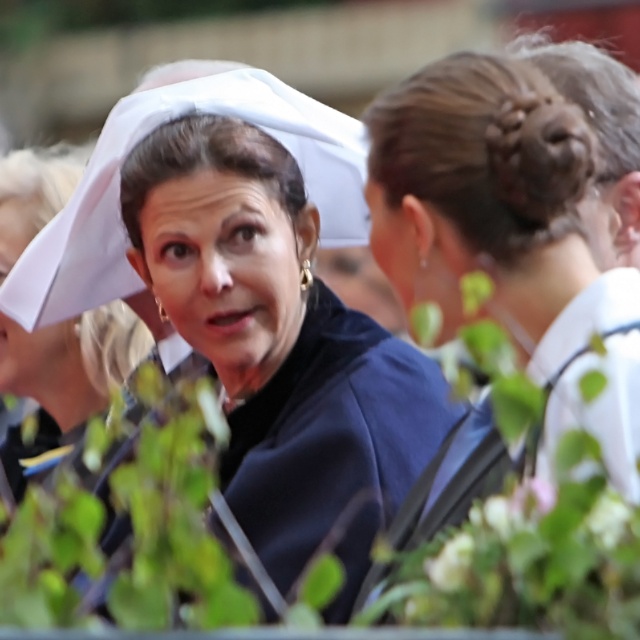
Question: Which point is farther from the camera taking this photo?

Choices:
 (A) (305, 502)
 (B) (568, 156)
 (C) (106, 364)

Answer: (C)

Question: Estimate the real-world distances between objects in this image. Which object is closer to the matte black dress at center?

Choices:
 (A) white matte nurse hat at center
 (B) sleek dark hair bun at upper right

Answer: (B)

Question: Among these points, which one is nearest to the camera?

Choices:
 (A) (436, 289)
 (B) (138, 176)

Answer: (A)

Question: Where is matte black dress at center located in relation to white matte nurse hat at center in the image?

Choices:
 (A) above
 (B) below

Answer: (A)

Question: Does matte black dress at center come behind sleek dark hair bun at upper right?

Choices:
 (A) no
 (B) yes

Answer: (B)

Question: Does matte black dress at center have a lesser width compared to white matte nurse hat at center?

Choices:
 (A) no
 (B) yes

Answer: (A)